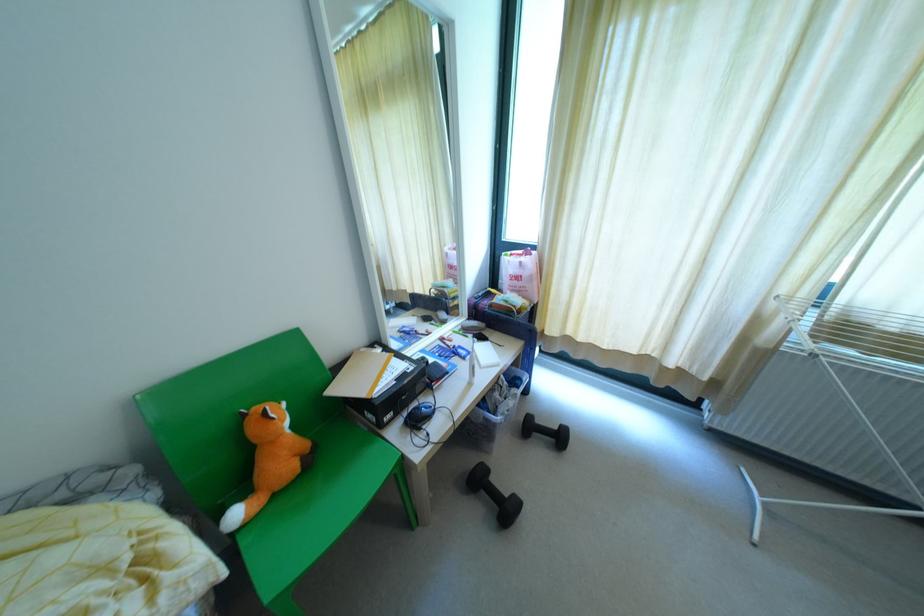
Locate an element on the screen. green chair sitting surface is located at coordinates (311, 505).